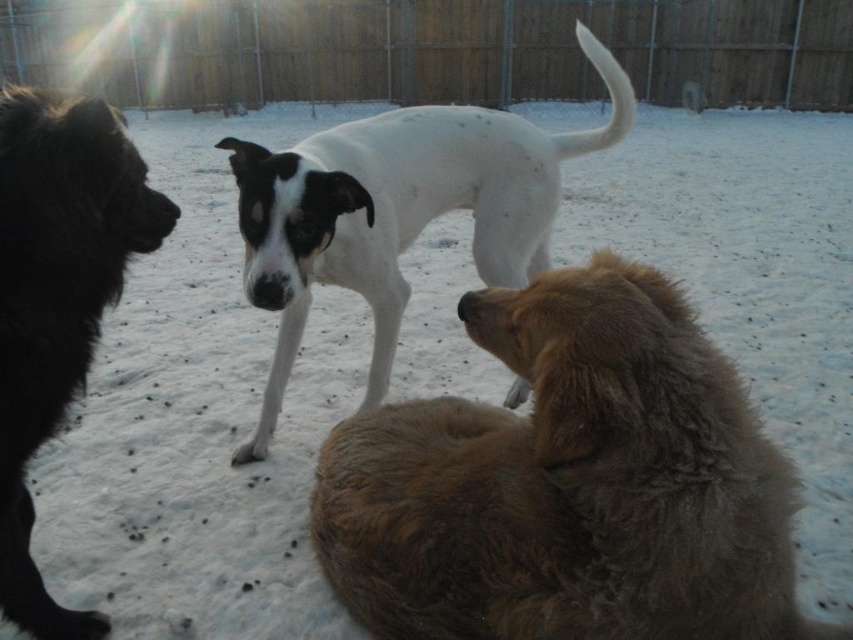
You are a photographer trying to capture a group photo of the fuzzy brown dog at lower right and the white smooth dog at center. Since you want both dogs to be clearly visible in the photo, which dog should you focus on first to ensure the other remains in the background?

You should focus on the fuzzy brown dog at lower right first because it is in front of the white smooth dog at center, so by focusing on the front dog, the one behind will naturally stay in the background.

You are standing at the bottom left corner of the image. You want to walk straight ahead to reach the white smooth dog at center. Is there any dog in your way?

The black fluffy dog on the left is in your path. Since you are starting at the bottom left corner and walking straight ahead, the black fluffy dog on the left is positioned in front of you, blocking your path to the white smooth dog at center.

You are standing at the center of the yard looking towards the fence. Which direction should you walk to reach the fuzzy brown dog at lower right?

Since the fuzzy brown dog at lower right is located at coordinates (x=567, y=483), you should walk towards the lower right direction to reach it.